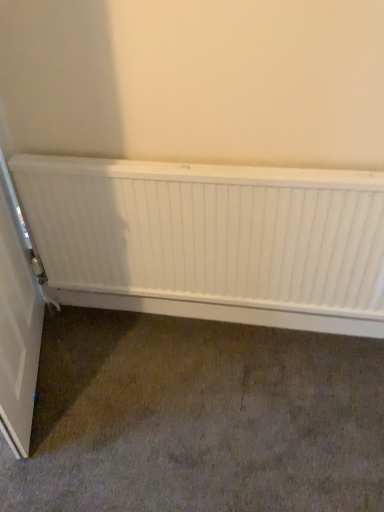
Where is `white matte door at left`? Image resolution: width=384 pixels, height=512 pixels. white matte door at left is located at coordinates (17, 321).

What do you see at coordinates (17, 321) in the screenshot?
I see `white matte door at left` at bounding box center [17, 321].

Describe the element at coordinates (211, 240) in the screenshot. I see `white matte radiator at center` at that location.

Where is `white matte radiator at center`? The height and width of the screenshot is (512, 384). white matte radiator at center is located at coordinates (211, 240).

At what (x,y) coordinates should I click in order to perform the action: click on white matte door at left. Please return your answer as a coordinate pair (x, y). Looking at the image, I should click on (17, 321).

Between white matte door at left and white matte radiator at center, which one appears on the right side from the viewer's perspective?

Positioned to the right is white matte radiator at center.

Is white matte door at left in front of white matte radiator at center?

That is True.

Considering the points (33, 271) and (167, 247), which point is in front, point (33, 271) or point (167, 247)?

Point (167, 247)

From the image's perspective, is white matte door at left located above or below white matte radiator at center?

Clearly, from the image's perspective, white matte door at left is below white matte radiator at center.

From a real-world perspective, which is physically below, white matte door at left or white matte radiator at center?

In real-world perspective, white matte door at left is lower.

Considering the relative sizes of white matte door at left and white matte radiator at center in the image provided, is white matte door at left wider than white matte radiator at center?

Indeed, white matte door at left has a greater width compared to white matte radiator at center.

Considering the relative sizes of white matte door at left and white matte radiator at center in the image provided, is white matte door at left shorter than white matte radiator at center?

No, white matte door at left is not shorter than white matte radiator at center.

Considering the sizes of objects white matte door at left and white matte radiator at center in the image provided, who is bigger, white matte door at left or white matte radiator at center?

With larger size is white matte door at left.

Would you say white matte radiator at center is part of white matte door at left's contents?

No, white matte radiator at center is located outside of white matte door at left.

Does white matte door at left touch white matte radiator at center?

They are not placed beside each other.

Could you tell me if white matte door at left is facing white matte radiator at center?

Yes, white matte door at left is oriented towards white matte radiator at center.

How different are the orientations of white matte door at left and white matte radiator at center in degrees?

They differ by 68.6 degrees in their facing directions.

Locate an element on the screen. This screenshot has width=384, height=512. door below the white matte radiator at center (from the image's perspective) is located at coordinates (17, 321).

Which object is positioned more to the right, white matte radiator at center or white matte door at left?

white matte radiator at center.

Between white matte radiator at center and white matte door at left, which one is positioned behind?

white matte radiator at center is further from the camera.

Does point (358, 204) appear closer or farther from the camera than point (11, 310)?

Point (358, 204) is closer to the camera than point (11, 310).

From the image's perspective, is white matte radiator at center located above or below white matte door at left?

From the image's perspective, white matte radiator at center appears above white matte door at left.

From a real-world perspective, between white matte radiator at center and white matte door at left, who is vertically lower?

white matte door at left is physically lower.

In terms of width, does white matte radiator at center look wider or thinner when compared to white matte door at left?

In the image, white matte radiator at center appears to be more narrow than white matte door at left.

Can you confirm if white matte radiator at center is taller than white matte door at left?

No.

Is white matte radiator at center bigger than white matte door at left?

Incorrect, white matte radiator at center is not larger than white matte door at left.

Is white matte radiator at center situated inside white matte door at left or outside?

white matte radiator at center is located beyond the bounds of white matte door at left.

Consider the image. Is white matte radiator at center in contact with white matte door at left?

No, white matte radiator at center is not making contact with white matte door at left.

Is white matte radiator at center positioned with its back to white matte door at left?

That's not correct — white matte radiator at center is not looking away from white matte door at left.

Based on the photo, how far apart are white matte radiator at center and white matte door at left?

white matte radiator at center is 22.04 inches away from white matte door at left.

Identify the location of radiator that is behind the white matte door at left. The height and width of the screenshot is (512, 384). (211, 240).

Where is `radiator that is behind the white matte door at left`? radiator that is behind the white matte door at left is located at coordinates (211, 240).

Identify the location of radiator on the right of white matte door at left. (211, 240).